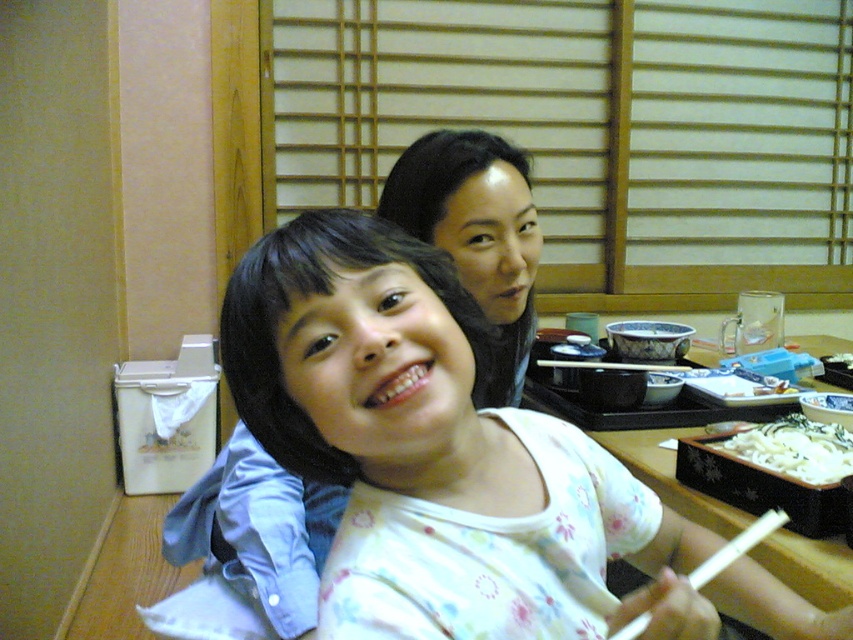
Question: Estimate the real-world distances between objects in this image. Which object is farther from the wooden table at center?

Choices:
 (A) white creamy noodles at lower right
 (B) floral cotton shirt at center
 (C) white plastic chopsticks at upper center
 (D) white plastic chopstick at lower center

Answer: (B)

Question: Does white creamy noodles at lower right have a smaller size compared to white plastic chopstick at lower center?

Choices:
 (A) yes
 (B) no

Answer: (A)

Question: Does floral cotton shirt at center appear over white plastic chopstick at lower center?

Choices:
 (A) yes
 (B) no

Answer: (A)

Question: Which of the following is the closest to the observer?

Choices:
 (A) floral cotton shirt at center
 (B) wooden table at center

Answer: (A)

Question: Does wooden table at center have a smaller size compared to white plastic chopsticks at upper center?

Choices:
 (A) no
 (B) yes

Answer: (A)

Question: Which point is closer to the camera taking this photo?

Choices:
 (A) (850, 458)
 (B) (757, 525)
 (C) (314, 355)
 (D) (643, 368)

Answer: (C)